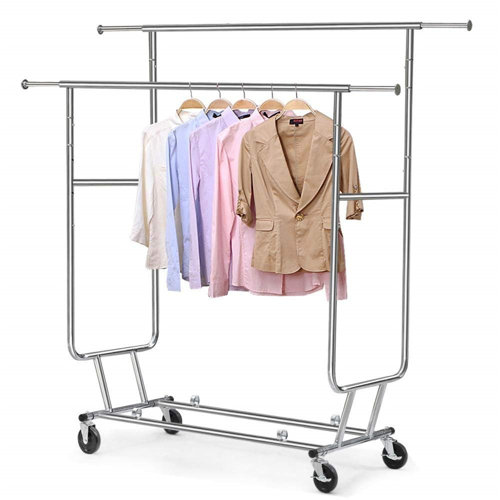
Identify the location of metal hanger portion. (296, 90), (271, 89), (243, 86), (217, 86), (188, 85).